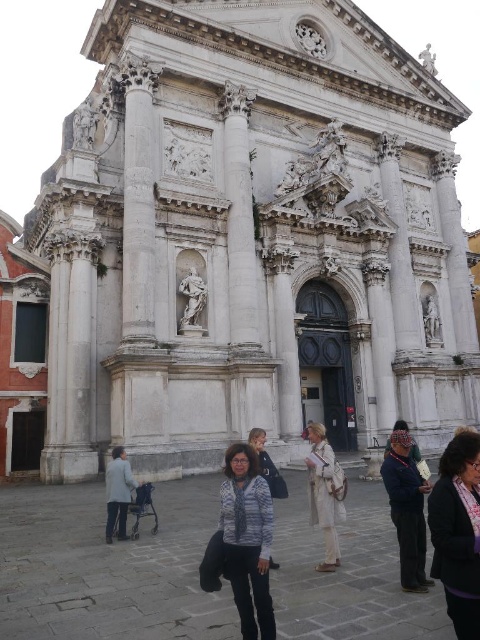
You are a delivery person who needs to place a package between the dark blue fabric at center and the blue knit sweater at center. The package requires a space of 6 meters. Can you fit it there?

The distance between the dark blue fabric at center and the blue knit sweater at center is 6.60 meters, so yes, the package requiring 6 meters of space can be placed there as there is enough room.

You are an artist standing in front of the grand building and you see both the dark blue fabric at center and the blue knit sweater at center. Which one is positioned to the right of the other?

The dark blue fabric at center is to the right of the blue knit sweater at center.

You are a parent with a baby in a stroller. You want to enter the grand building through its main entrance. However, there is an obstacle at point (x=118, y=492). What is blocking your path?

The light gray fabric stroller at lower left is blocking the path at point (x=118, y=492).